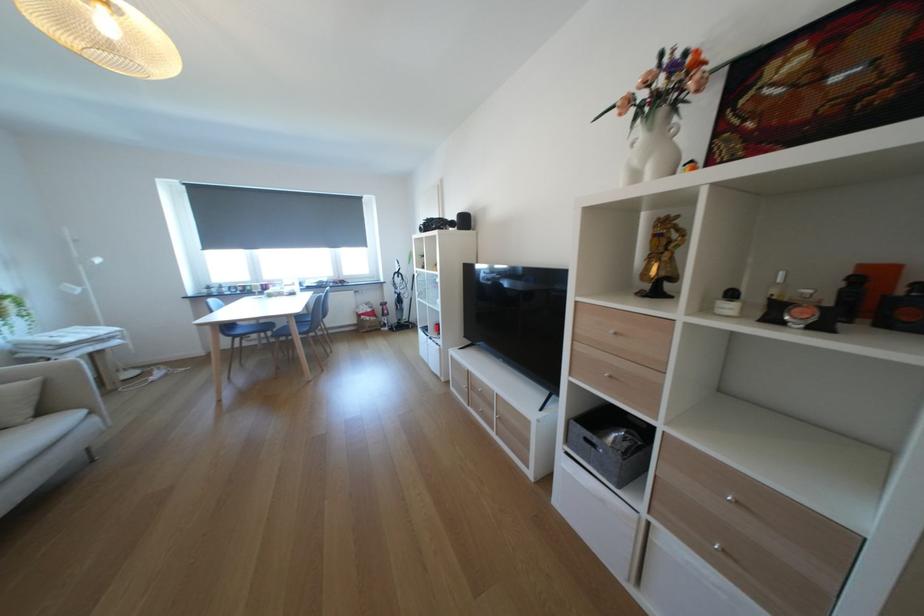
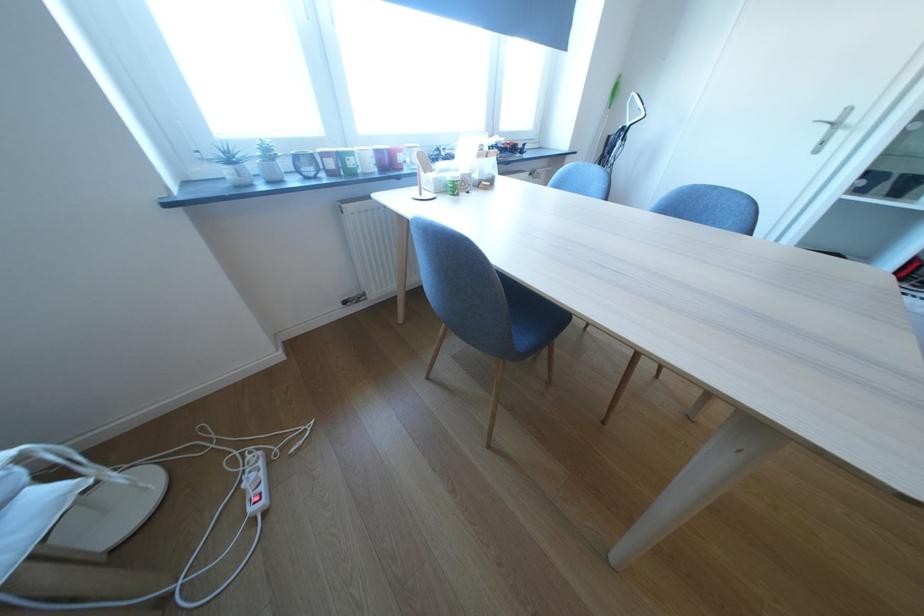
Find the pixel in the second image that matches pixel 251 290 in the first image.

(342, 164)